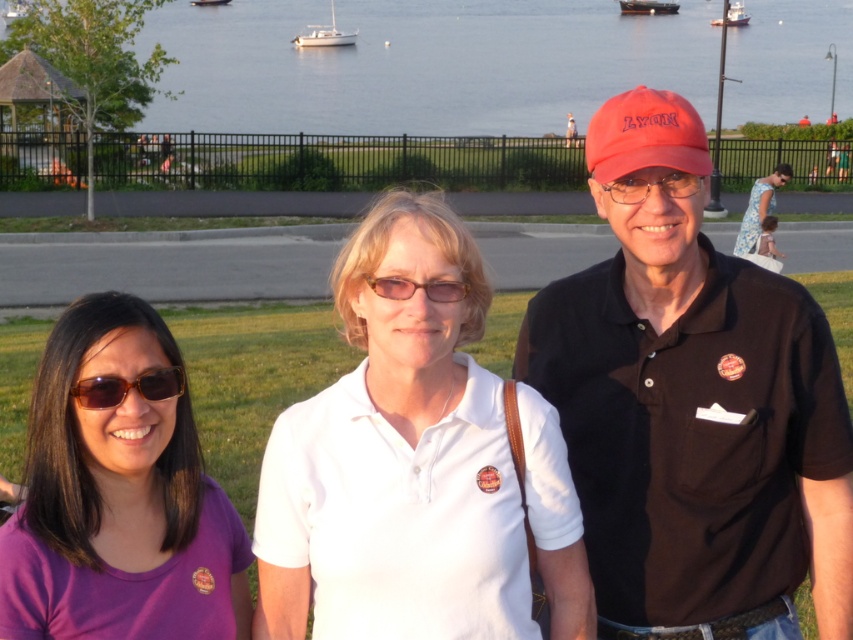
Question: Considering the real-world distances, which object is closest to the transparent plastic glasses at center?

Choices:
 (A) white glossy sailboat at upper center
 (B) matte black glasses at center
 (C) metallic gray ship at upper center
 (D) white plastic boat at upper left

Answer: (B)

Question: Which point is closer to the camera?

Choices:
 (A) blue water at center
 (B) purple cotton polo shirt at lower left
 (C) white matte shirt at center
 (D) metallic gray ship at upper center

Answer: (B)

Question: Is white matte shirt at center positioned before white plastic boat at upper left?

Choices:
 (A) no
 (B) yes

Answer: (B)

Question: Does white plastic boat at upper left appear under white plastic boat at upper center?

Choices:
 (A) yes
 (B) no

Answer: (A)

Question: Is white glossy sailboat at upper center wider than white plastic boat at center?

Choices:
 (A) yes
 (B) no

Answer: (A)

Question: Which point is farther from the camera taking this photo?

Choices:
 (A) (566, 40)
 (B) (103, 385)
 (C) (666, 131)

Answer: (A)